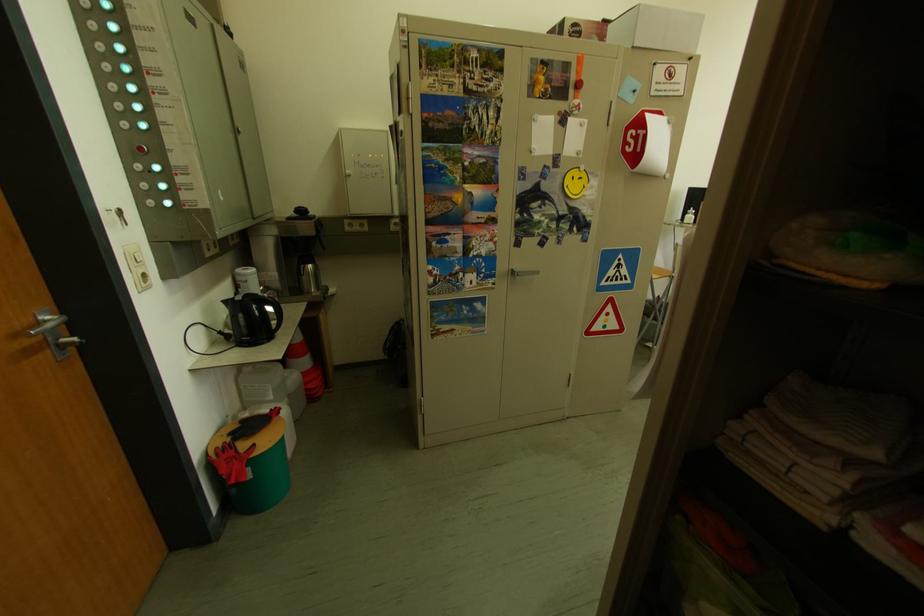
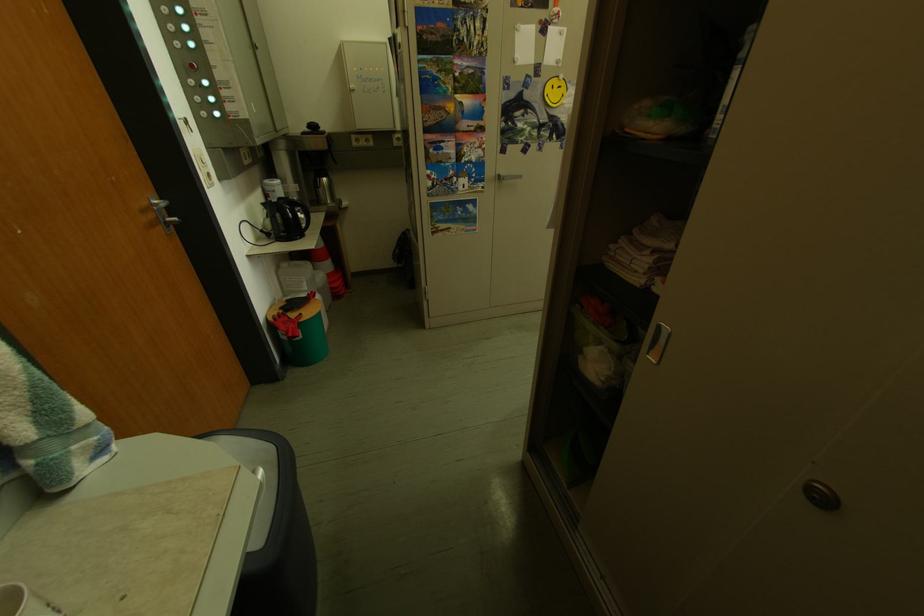
In the second image, find the point that corresponds to (x=287, y=341) in the first image.

(319, 238)